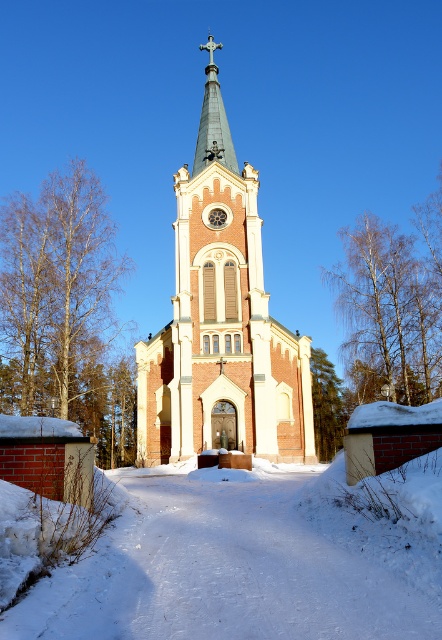
Looking at this image, is light beige stone church steeple at center smaller than shiny gold spire at center?

No.

What do you see at coordinates (221, 321) in the screenshot? I see `light beige stone church steeple at center` at bounding box center [221, 321].

Measure the distance between light beige stone church steeple at center and camera.

A distance of 68.28 meters exists between light beige stone church steeple at center and camera.

Locate an element on the screen. Image resolution: width=442 pixels, height=640 pixels. light beige stone church steeple at center is located at coordinates (221, 321).

Is point (327, 566) behind point (209, 108)?

No.

Is white powdery snow at center wider than shiny gold spire at center?

Correct, the width of white powdery snow at center exceeds that of shiny gold spire at center.

Between point (438, 620) and point (209, 99), which one is positioned in front?

Point (438, 620) is more forward.

Locate an element on the screen. Image resolution: width=442 pixels, height=640 pixels. white powdery snow at center is located at coordinates (247, 564).

Between point (182, 518) and point (206, 259), which one is positioned in front?

Point (182, 518)

The height and width of the screenshot is (640, 442). Describe the element at coordinates (247, 564) in the screenshot. I see `white powdery snow at center` at that location.

Does point (420, 566) come behind point (221, 416)?

No, it is in front of (221, 416).

Locate an element on the screen. This screenshot has height=640, width=442. white powdery snow at center is located at coordinates pos(247,564).